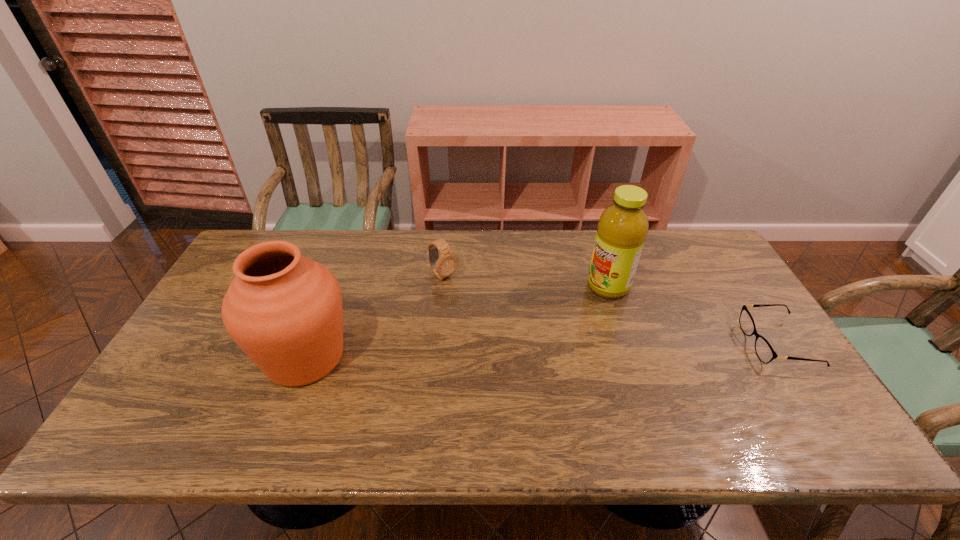
The height and width of the screenshot is (540, 960). I want to click on vacant area located on the face of the third tallest object, so click(489, 318).

Where is `vacant area situated 0.130m on the face of the third tallest object`? The width and height of the screenshot is (960, 540). vacant area situated 0.130m on the face of the third tallest object is located at coordinates coord(478,308).

At what (x,y) coordinates should I click in order to perform the action: click on blank area located 0.350m on the face of the third tallest object. Please return your answer as a coordinate pair (x, y). This screenshot has height=540, width=960. Looking at the image, I should click on (529, 355).

This screenshot has height=540, width=960. I want to click on free location located 0.220m on the front label of the third object from left to right, so click(x=534, y=323).

The image size is (960, 540). What are the coordinates of `vacant area situated 0.110m on the front label of the third object from left to right` in the screenshot? It's located at (564, 308).

You are a GUI agent. You are given a task and a screenshot of the screen. Output one action in this format:
    pyautogui.click(x=<x>, y=<y>)
    Task: Click on the free space located 0.110m on the front label of the third object from left to right
    
    Given the screenshot: What is the action you would take?
    pyautogui.click(x=564, y=308)

The image size is (960, 540). What are the coordinates of `watch that is positioned at the far edge` in the screenshot? It's located at [x=443, y=266].

Where is `fruit juice that is positioned at the far edge`? The image size is (960, 540). fruit juice that is positioned at the far edge is located at coordinates (622, 229).

Identify the location of object at the near edge. (284, 310).

Locate an element on the screen. This screenshot has width=960, height=540. object situated at the right edge is located at coordinates (763, 349).